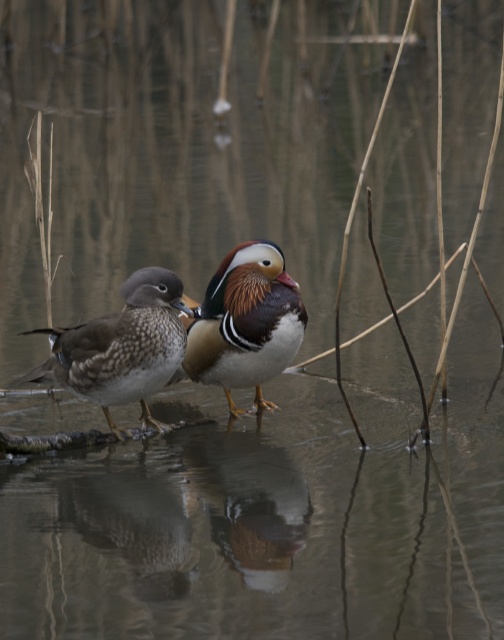
You are a wildlife photographer aiming to capture a clear photo of the speckled feather duck at left. Based on the coordinates provided, where should you position your camera relative to the center of the image to ensure the duck is in the frame?

The speckled feather duck at left is located at coordinates point (x=120, y=348). To ensure it is in the frame, position your camera slightly to the right and lower than the center of the image.

You are observing two ducks on a branch in a peaceful pond. The speckled feather duck at left and the shiny brown duck at center are both visible. If you were to look from the left side of the branch, which duck would you see first?

The speckled feather duck at left would be seen first when looking from the left side of the branch since it is positioned to the left of the shiny brown duck at center.